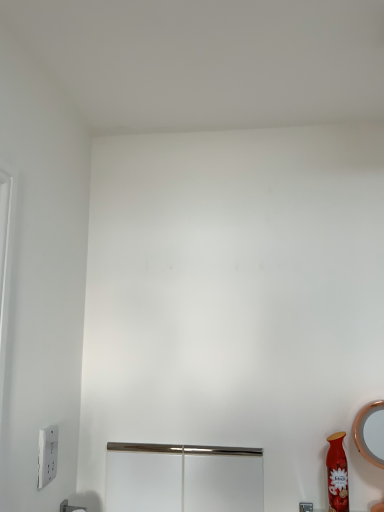
Image resolution: width=384 pixels, height=512 pixels. I want to click on matte red vase at lower right, so click(x=337, y=474).

Describe the element at coordinates (47, 455) in the screenshot. I see `white plastic light switch at lower left` at that location.

What are the coordinates of `polished metal screen door at center` in the screenshot? It's located at (183, 478).

Consider the image. Does white plastic light switch at lower left come behind matte red vase at lower right?

No.

Which object is positioned more to the right, white plastic light switch at lower left or matte red vase at lower right?

Positioned to the right is matte red vase at lower right.

Is white plastic light switch at lower left oriented away from matte red vase at lower right?

No, white plastic light switch at lower left is not facing the opposite direction of matte red vase at lower right.

This screenshot has height=512, width=384. In order to click on vase below the white plastic light switch at lower left (from a real-world perspective) in this screenshot , I will do `click(337, 474)`.

Is polished metal screen door at center positioned with its back to matte red vase at lower right?

polished metal screen door at center is not turned away from matte red vase at lower right.

Based on their sizes in the image, would you say polished metal screen door at center is bigger or smaller than matte red vase at lower right?

Clearly, polished metal screen door at center is larger in size than matte red vase at lower right.

Is polished metal screen door at center positioned beyond the bounds of matte red vase at lower right?

polished metal screen door at center lies outside matte red vase at lower right's area.

Which of these two, polished metal screen door at center or matte red vase at lower right, is wider?

With larger width is matte red vase at lower right.

Consider the image. Would you say white plastic light switch at lower left is part of matte red vase at lower right's contents?

No, white plastic light switch at lower left is not surrounded by matte red vase at lower right.

From the image's perspective, which object appears higher, matte red vase at lower right or white plastic light switch at lower left?

white plastic light switch at lower left.

Can you confirm if matte red vase at lower right is smaller than white plastic light switch at lower left?

Actually, matte red vase at lower right might be larger than white plastic light switch at lower left.

From a real-world perspective, which is physically above, matte red vase at lower right or white plastic light switch at lower left?

In real-world perspective, white plastic light switch at lower left is above.

Looking at this image, which object is closer to the camera taking this photo, polished metal screen door at center or white plastic light switch at lower left?

white plastic light switch at lower left is closer to the camera.

Between polished metal screen door at center and white plastic light switch at lower left, which one appears on the left side from the viewer's perspective?

From the viewer's perspective, white plastic light switch at lower left appears more on the left side.

The image size is (384, 512). I want to click on screen door below the white plastic light switch at lower left (from a real-world perspective), so click(183, 478).

Is point (196, 450) more distant than point (46, 463)?

Yes, point (196, 450) is farther from viewer.

Is matte red vase at lower right not close to polished metal screen door at center?

No, there isn't a large distance between matte red vase at lower right and polished metal screen door at center.

Based on their positions, is matte red vase at lower right located to the left or right of polished metal screen door at center?

In the image, matte red vase at lower right appears on the right side of polished metal screen door at center.

Which object is thinner, matte red vase at lower right or polished metal screen door at center?

polished metal screen door at center is thinner.

Consider the image. From the image's perspective, is matte red vase at lower right beneath polished metal screen door at center?

No, from the image's perspective, matte red vase at lower right is not below polished metal screen door at center.

Considering the relative positions of white plastic light switch at lower left and polished metal screen door at center in the image provided, is white plastic light switch at lower left to the left or to the right of polished metal screen door at center?

Based on their positions, white plastic light switch at lower left is located to the left of polished metal screen door at center.

Between white plastic light switch at lower left and polished metal screen door at center, which one has smaller size?

white plastic light switch at lower left.

Is white plastic light switch at lower left taller or shorter than polished metal screen door at center?

white plastic light switch at lower left is shorter than polished metal screen door at center.

Is white plastic light switch at lower left facing away from polished metal screen door at center?

No, white plastic light switch at lower left's orientation is not away from polished metal screen door at center.

The width and height of the screenshot is (384, 512). I want to click on light switch on the left of matte red vase at lower right, so click(x=47, y=455).

What are the coordinates of `vase that is in front of the polished metal screen door at center` in the screenshot? It's located at point(337,474).

Which object lies nearer to the anchor point polished metal screen door at center, matte red vase at lower right or white plastic light switch at lower left?

Among the two, white plastic light switch at lower left is located nearer to polished metal screen door at center.

In the scene shown: From the image, which object appears to be nearer to white plastic light switch at lower left, matte red vase at lower right or polished metal screen door at center?

polished metal screen door at center.

Which object lies further to the anchor point polished metal screen door at center, white plastic light switch at lower left or matte red vase at lower right?

matte red vase at lower right is further to polished metal screen door at center.

When comparing their distances from white plastic light switch at lower left, does polished metal screen door at center or matte red vase at lower right seem closer?

polished metal screen door at center is closer to white plastic light switch at lower left.

Considering their positions, is white plastic light switch at lower left positioned further to matte red vase at lower right than polished metal screen door at center?

white plastic light switch at lower left is positioned further to the anchor matte red vase at lower right.

From the image, which object appears to be nearer to matte red vase at lower right, polished metal screen door at center or white plastic light switch at lower left?

Based on the image, polished metal screen door at center appears to be nearer to matte red vase at lower right.

The height and width of the screenshot is (512, 384). In order to click on screen door between white plastic light switch at lower left and matte red vase at lower right from left to right in this screenshot , I will do `click(183, 478)`.